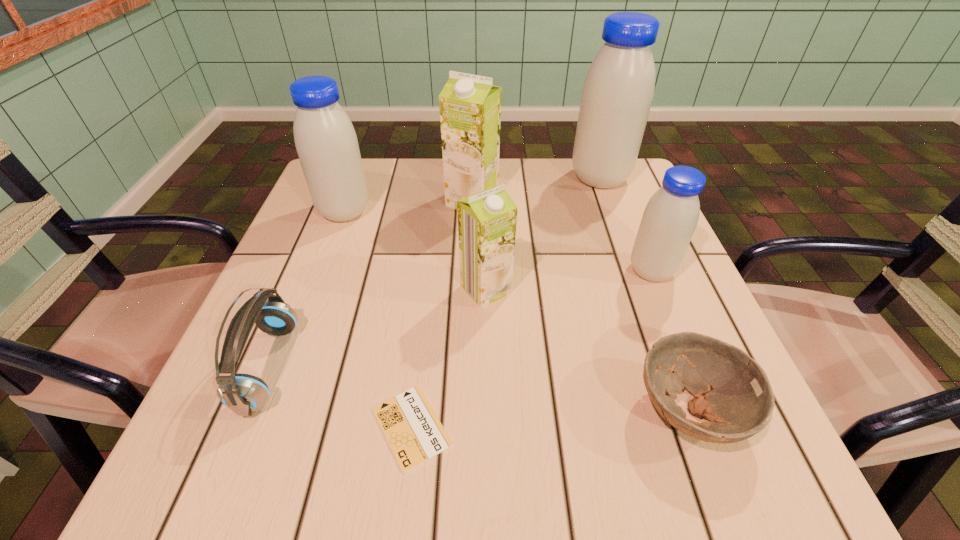
Locate an element on the screen. This screenshot has height=540, width=960. bowl that is at the near edge is located at coordinates (732, 391).

Identify the location of identity card located at the near edge. (415, 434).

Identify the location of soya milk at the left edge. (327, 146).

The image size is (960, 540). What are the coordinates of `headset that is positioned at the left edge` in the screenshot? It's located at (244, 394).

I want to click on bowl present at the right edge, so click(x=732, y=391).

I want to click on object at the far left corner, so click(327, 146).

Find the location of a particular element. This screenshot has width=960, height=540. object present at the far right corner is located at coordinates (618, 91).

This screenshot has width=960, height=540. What are the coordinates of `object at the near right corner` in the screenshot? It's located at (732, 391).

In the image, there is a desktop. Where is `vacant space at the far edge`? vacant space at the far edge is located at coordinates (406, 186).

At what (x,y) coordinates should I click in order to perform the action: click on vacant space at the near edge. Please return your answer as a coordinate pair (x, y). The image size is (960, 540). Looking at the image, I should click on (588, 454).